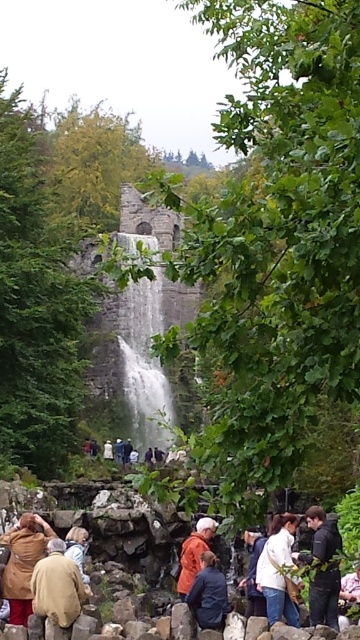
Can you confirm if brown woolen coat at lower left is wider than dark brown leather jacket at lower center?

Correct, the width of brown woolen coat at lower left exceeds that of dark brown leather jacket at lower center.

Is brown woolen coat at lower left bigger than dark brown leather jacket at lower center?

No.

You are a GUI agent. You are given a task and a screenshot of the screen. Output one action in this format:
    pyautogui.click(x=<x>, y=<y>)
    Task: Click on the brown woolen coat at lower left
    The height and width of the screenshot is (640, 360).
    Given the screenshot: What is the action you would take?
    pyautogui.click(x=23, y=563)

Describe the element at coordinates (277, 570) in the screenshot. I see `white matte jacket at lower center` at that location.

I want to click on white matte jacket at lower center, so click(x=277, y=570).

Find the location of a particular element. white matte jacket at lower center is located at coordinates (277, 570).

Does white textured water at center have a larger size compared to white cotton shirt at center?

Correct, white textured water at center is larger in size than white cotton shirt at center.

Is point (142, 426) behind point (255, 550)?

Yes.

Identify the location of white textured water at center. (144, 362).